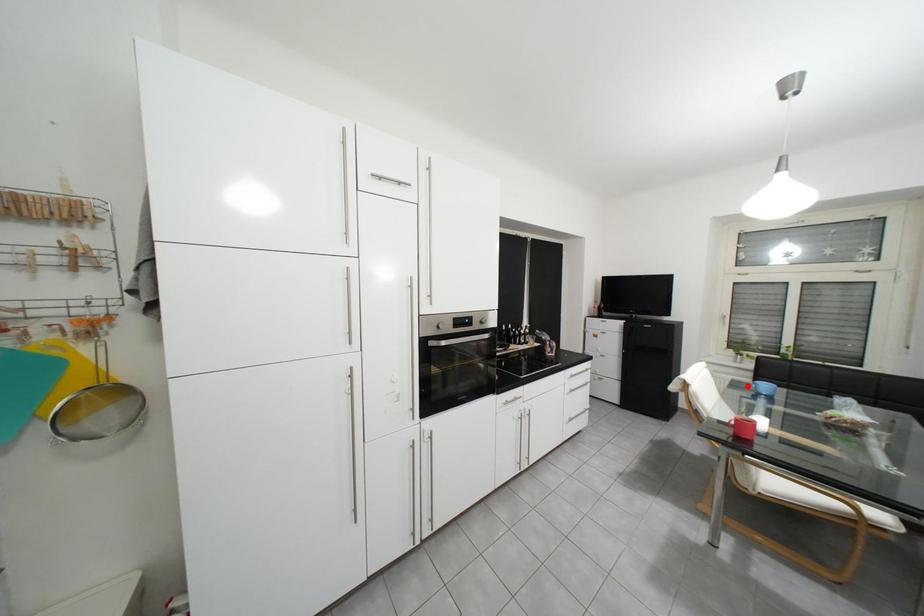
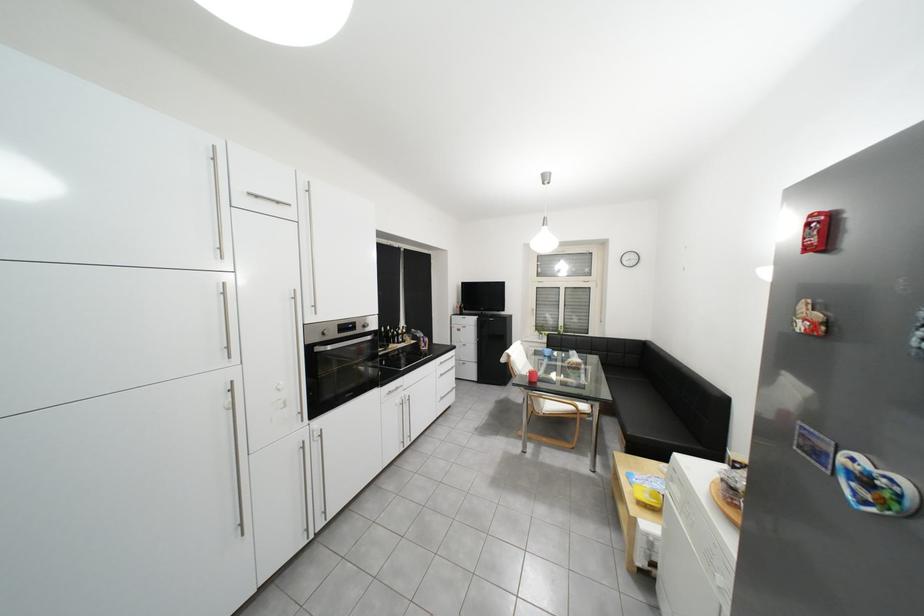
In the second image, find the point that corresponds to the highlighted location in the first image.

(548, 354)